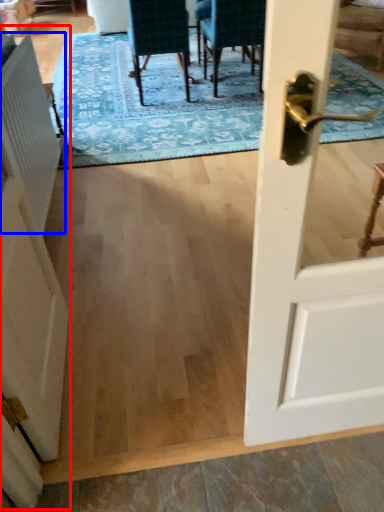
Question: Which of the following is the closest to the observer, barn door (highlighted by a red box) or radiator (highlighted by a blue box)?

Choices:
 (A) barn door
 (B) radiator

Answer: (A)